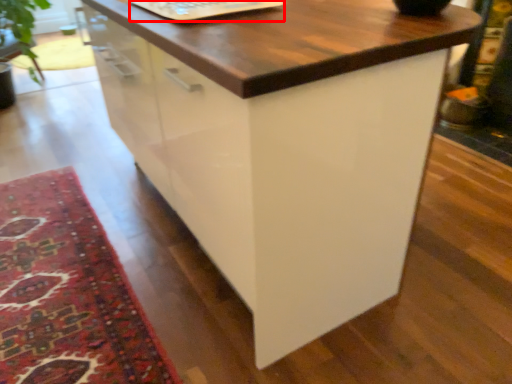
Question: From the image's perspective, what is the correct spatial positioning of laptop keyboard (annotated by the red box) in reference to mat?

Choices:
 (A) above
 (B) below

Answer: (A)